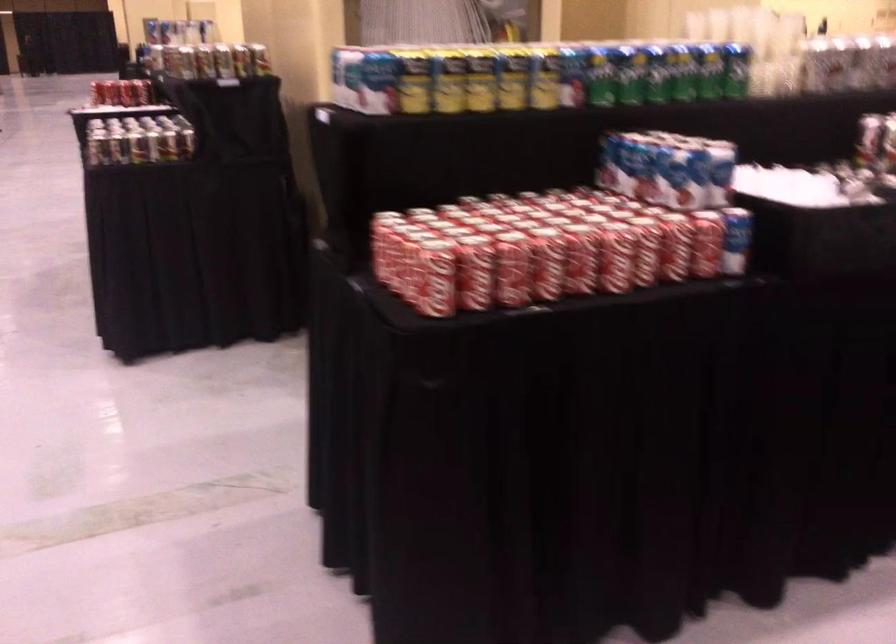
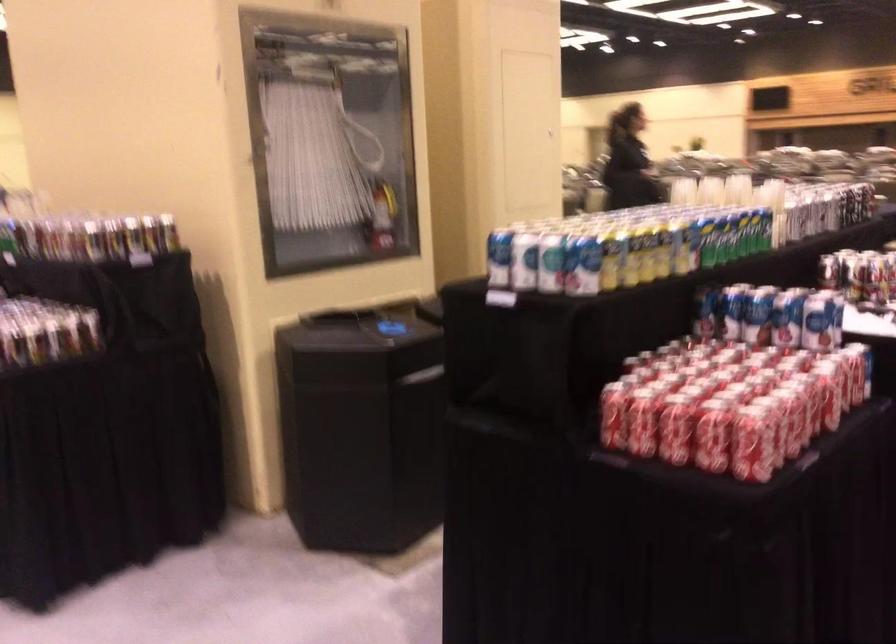
Where in the second image is the point corresponding to pixel 622 165 from the first image?

(757, 315)